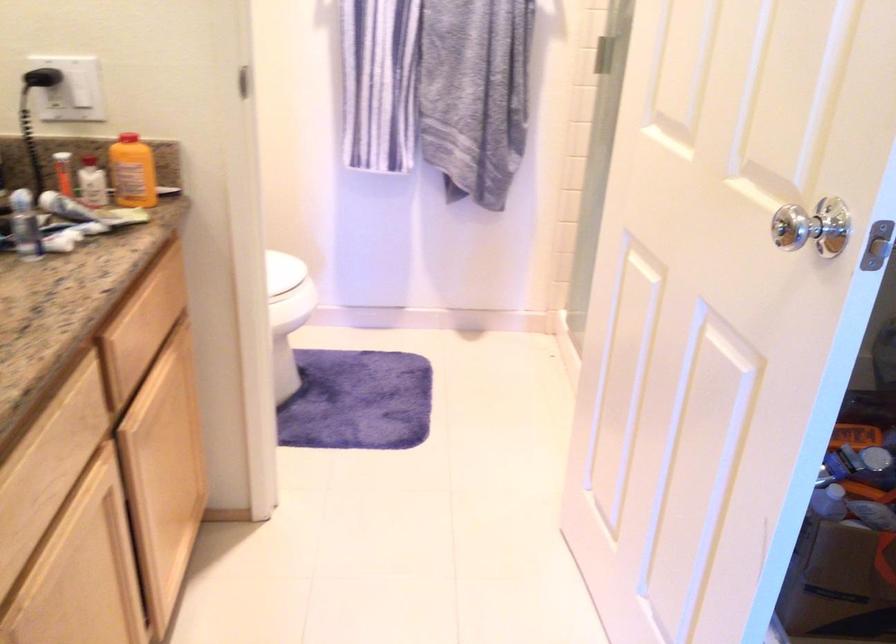
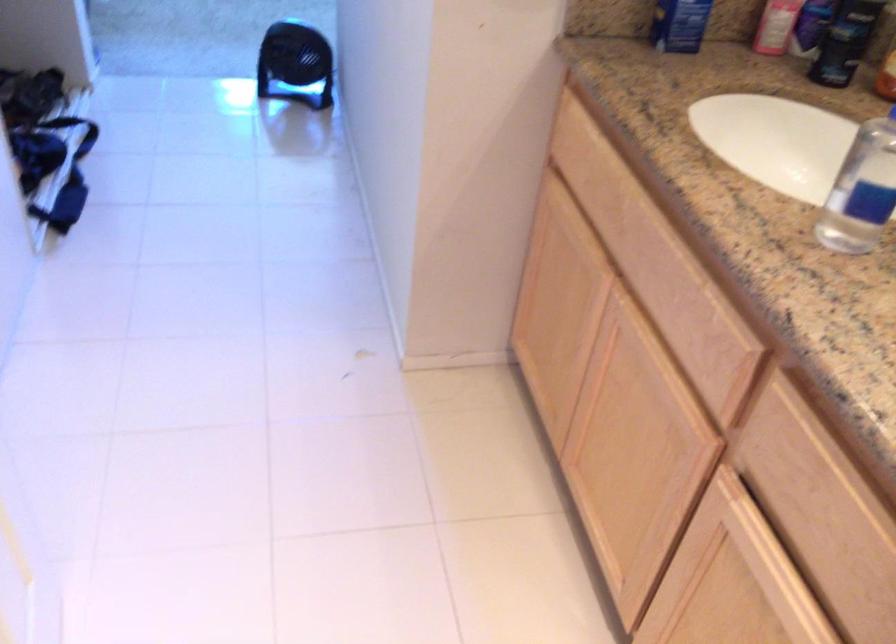
Where in the second image is the point corresponding to the point at 116,468 from the first image?

(684, 429)